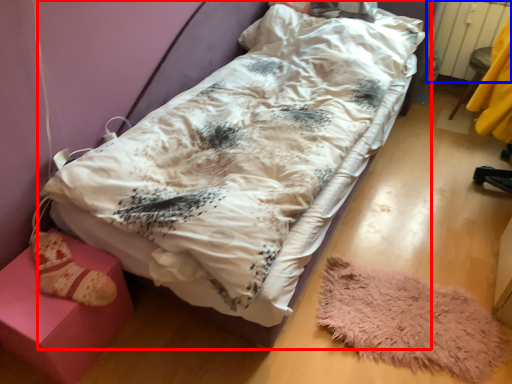
Question: Among these objects, which one is farthest to the camera, hospital bed (highlighted by a red box) or radiator (highlighted by a blue box)?

Choices:
 (A) hospital bed
 (B) radiator

Answer: (B)